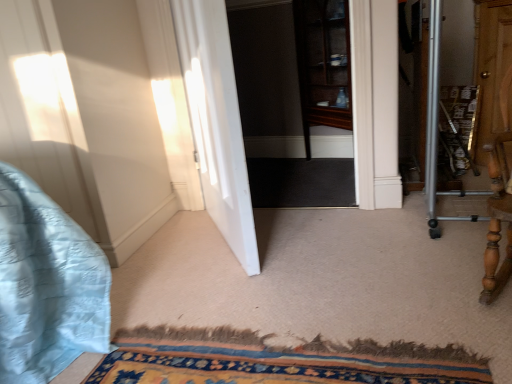
Question: Should I look upward or downward to see carpeted mat at lower center?

Choices:
 (A) down
 (B) up

Answer: (A)

Question: From the image's perspective, is transparent glass cabinet at center on white smooth door at center?

Choices:
 (A) yes
 (B) no

Answer: (A)

Question: Is transparent glass cabinet at center at the right side of white smooth door at center?

Choices:
 (A) no
 (B) yes

Answer: (B)

Question: From the image's perspective, is transparent glass cabinet at center beneath white smooth door at center?

Choices:
 (A) no
 (B) yes

Answer: (A)

Question: Could you tell me if transparent glass cabinet at center is facing white smooth door at center?

Choices:
 (A) no
 (B) yes

Answer: (B)

Question: Is transparent glass cabinet at center located outside white smooth door at center?

Choices:
 (A) yes
 (B) no

Answer: (A)

Question: Is transparent glass cabinet at center taller than white smooth door at center?

Choices:
 (A) no
 (B) yes

Answer: (A)

Question: Does carpeted mat at lower center have a lesser width compared to transparent glass cabinet at center?

Choices:
 (A) yes
 (B) no

Answer: (B)

Question: From a real-world perspective, does carpeted mat at lower center stand above transparent glass cabinet at center?

Choices:
 (A) no
 (B) yes

Answer: (A)

Question: Considering the relative sizes of carpeted mat at lower center and transparent glass cabinet at center in the image provided, is carpeted mat at lower center smaller than transparent glass cabinet at center?

Choices:
 (A) no
 (B) yes

Answer: (B)

Question: Considering the relative positions of carpeted mat at lower center and transparent glass cabinet at center in the image provided, is carpeted mat at lower center in front of transparent glass cabinet at center?

Choices:
 (A) no
 (B) yes

Answer: (B)

Question: From the image's perspective, is carpeted mat at lower center on top of transparent glass cabinet at center?

Choices:
 (A) yes
 (B) no

Answer: (B)

Question: Is carpeted mat at lower center completely or partially outside of transparent glass cabinet at center?

Choices:
 (A) no
 (B) yes

Answer: (B)

Question: Is white smooth door at center to the left of transparent glass cabinet at center from the viewer's perspective?

Choices:
 (A) yes
 (B) no

Answer: (A)